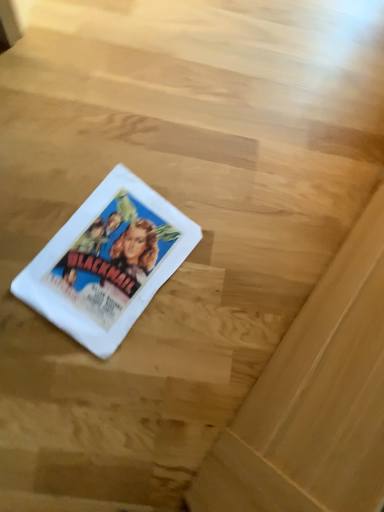
What do you see at coordinates (108, 262) in the screenshot? I see `white fabric at center` at bounding box center [108, 262].

This screenshot has width=384, height=512. Find the location of `white fabric at center`. white fabric at center is located at coordinates (108, 262).

Where is `white fabric at center`? white fabric at center is located at coordinates (108, 262).